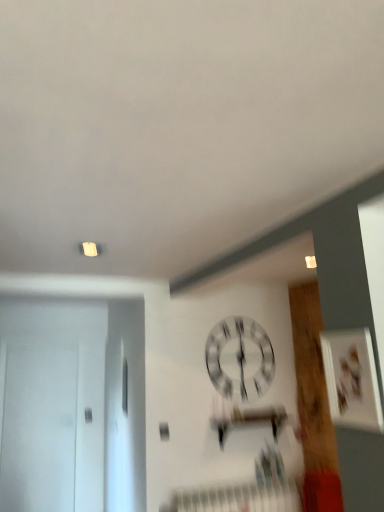
Question: Can you confirm if white glossy clock at center is thinner than white matte door at left?

Choices:
 (A) yes
 (B) no

Answer: (A)

Question: Considering the relative positions of white glossy clock at center and white matte door at left in the image provided, is white glossy clock at center in front of white matte door at left?

Choices:
 (A) yes
 (B) no

Answer: (A)

Question: Is white glossy clock at center outside of white matte door at left?

Choices:
 (A) no
 (B) yes

Answer: (B)

Question: Does white glossy clock at center lie behind white matte door at left?

Choices:
 (A) no
 (B) yes

Answer: (A)

Question: From a real-world perspective, is white glossy clock at center under white matte door at left?

Choices:
 (A) yes
 (B) no

Answer: (B)

Question: Could you tell me if white glossy clock at center is facing white matte door at left?

Choices:
 (A) no
 (B) yes

Answer: (A)

Question: Does white matte door at left appear on the right side of white glossy clock at center?

Choices:
 (A) yes
 (B) no

Answer: (B)

Question: Is white matte door at left not inside white glossy clock at center?

Choices:
 (A) yes
 (B) no

Answer: (A)

Question: Does white matte door at left come in front of white glossy clock at center?

Choices:
 (A) yes
 (B) no

Answer: (B)

Question: Is white glossy clock at center surrounded by white matte door at left?

Choices:
 (A) yes
 (B) no

Answer: (B)

Question: From a real-world perspective, does white matte door at left stand above white glossy clock at center?

Choices:
 (A) no
 (B) yes

Answer: (A)

Question: Is white matte door at left next to white glossy clock at center?

Choices:
 (A) no
 (B) yes

Answer: (A)

Question: In terms of height, does white glossy clock at center look taller or shorter compared to white matte door at left?

Choices:
 (A) tall
 (B) short

Answer: (B)